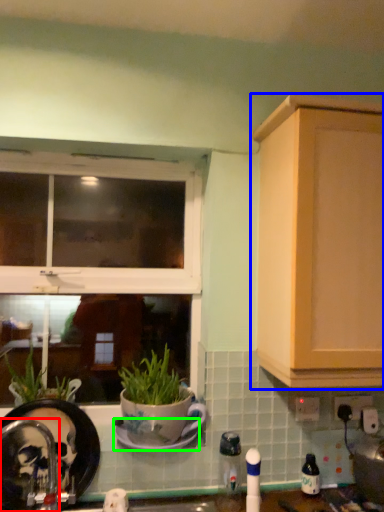
Question: Which object is positioned farthest from faucet (highlighted by a red box)? Select from cabinetry (highlighted by a blue box) and saucer (highlighted by a green box).

Choices:
 (A) cabinetry
 (B) saucer

Answer: (A)